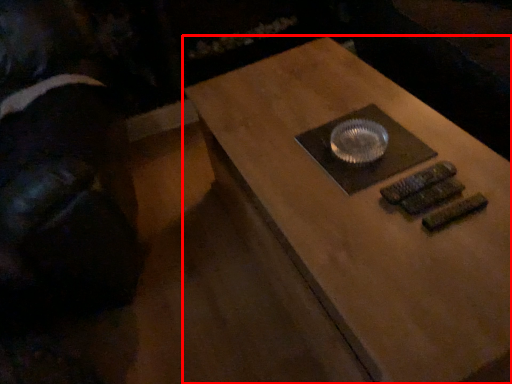
Question: From the image's perspective, where is table (annotated by the red box) located in relation to person in the image?

Choices:
 (A) below
 (B) above

Answer: (A)